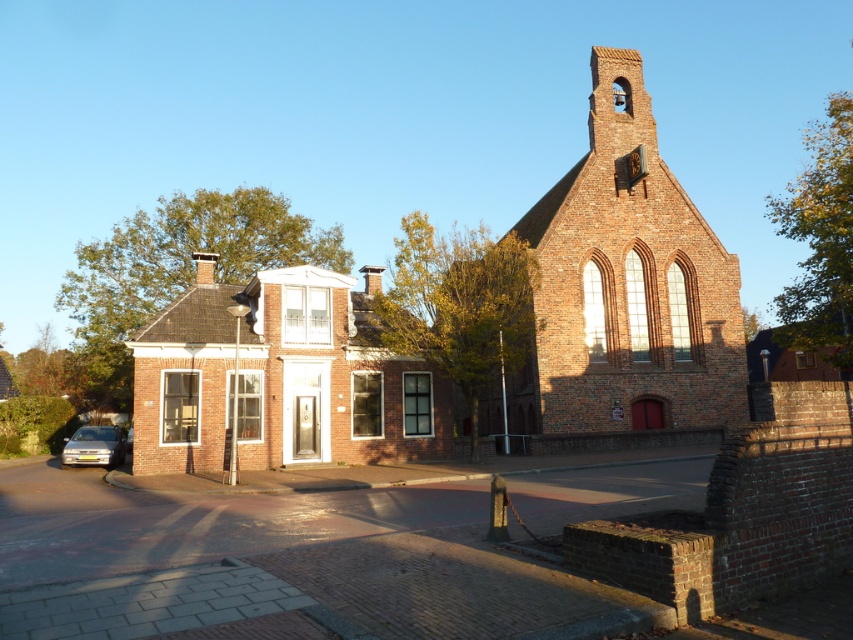
Looking at this image, you are standing in the middle of the street looking at the brick church at center and the brick house at center. Which one is higher up in the image?

The brick church at center is higher up in the image than the brick house at center because it is above it.

You are a photographer planning to capture the brick church at center and the silver metallic car at lower left in a single frame. Given that the car is parked closer to you, will the church still appear larger in the photo compared to the car?

The brick church at center is taller than the silver metallic car at lower left, so even though the car is closer, the church will still appear larger in the photo due to its actual size difference.

You are standing in the middle of the street looking at the brick house at center and the silver metallic car at lower left. Which object is taller?

The brick house at center is much taller than the silver metallic car at lower left.